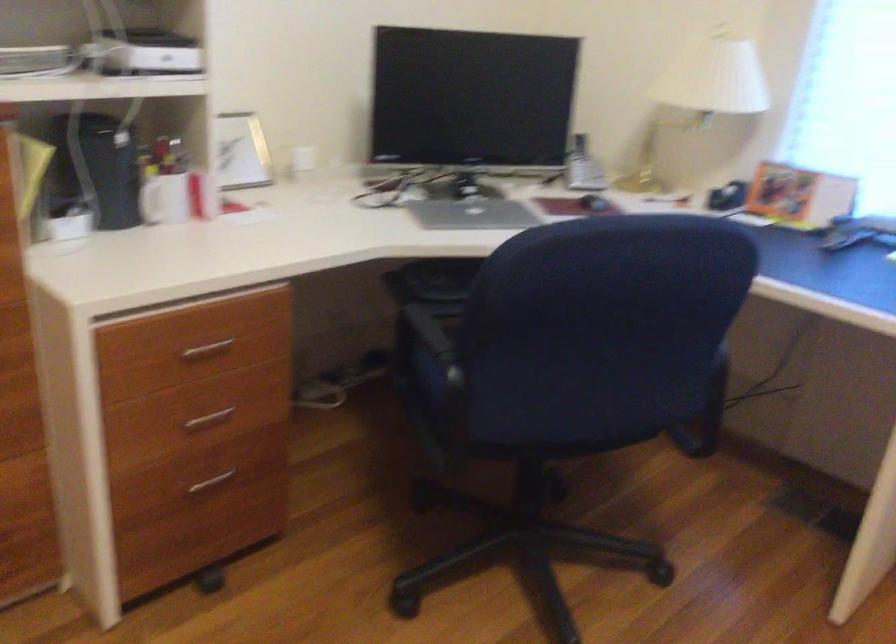
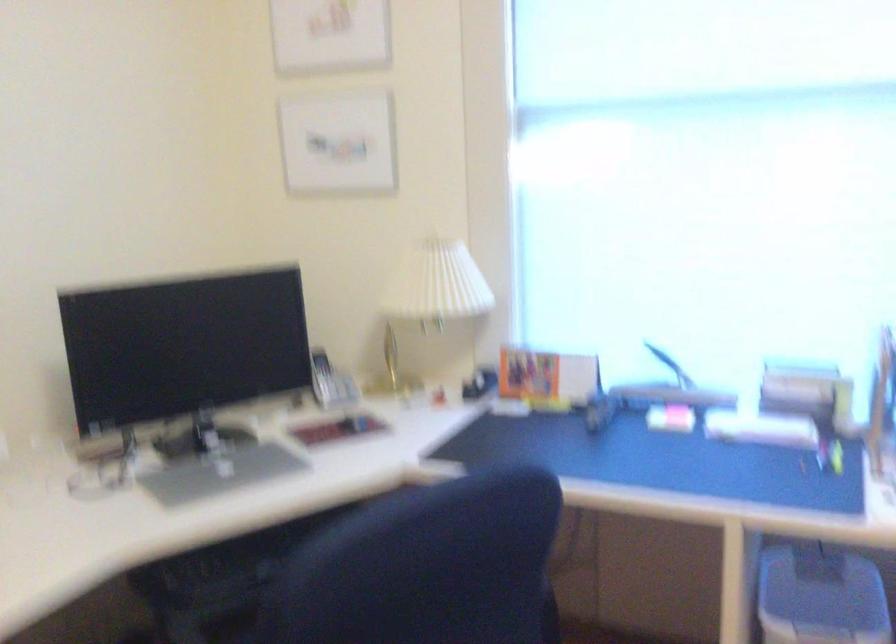
Where in the second image is the point corresponding to [584,166] from the first image?

(330, 382)